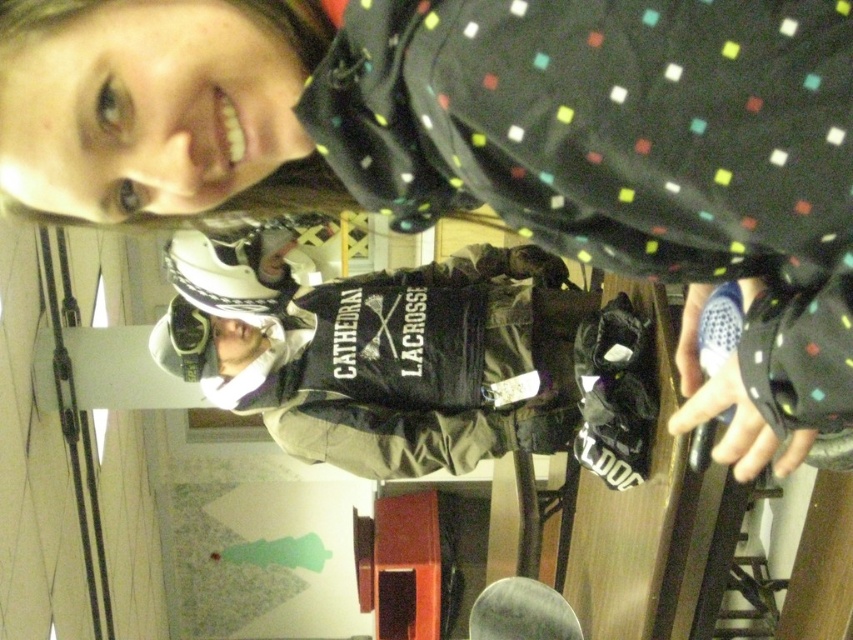
Question: Which point is closer to the camera?

Choices:
 (A) camouflage fabric snowboard at center
 (B) matte black goggles at center

Answer: (A)

Question: Is camouflage fabric snowboard at center wider than matte black goggles at center?

Choices:
 (A) no
 (B) yes

Answer: (B)

Question: Which of the following is the farthest from the observer?

Choices:
 (A) matte black goggles at center
 (B) camouflage fabric snowboard at center

Answer: (A)

Question: Which point is closer to the camera?

Choices:
 (A) (399, 465)
 (B) (199, 314)

Answer: (A)

Question: Can you confirm if camouflage fabric snowboard at center is smaller than matte black goggles at center?

Choices:
 (A) no
 (B) yes

Answer: (A)

Question: Can you confirm if camouflage fabric snowboard at center is smaller than matte black goggles at center?

Choices:
 (A) no
 (B) yes

Answer: (A)